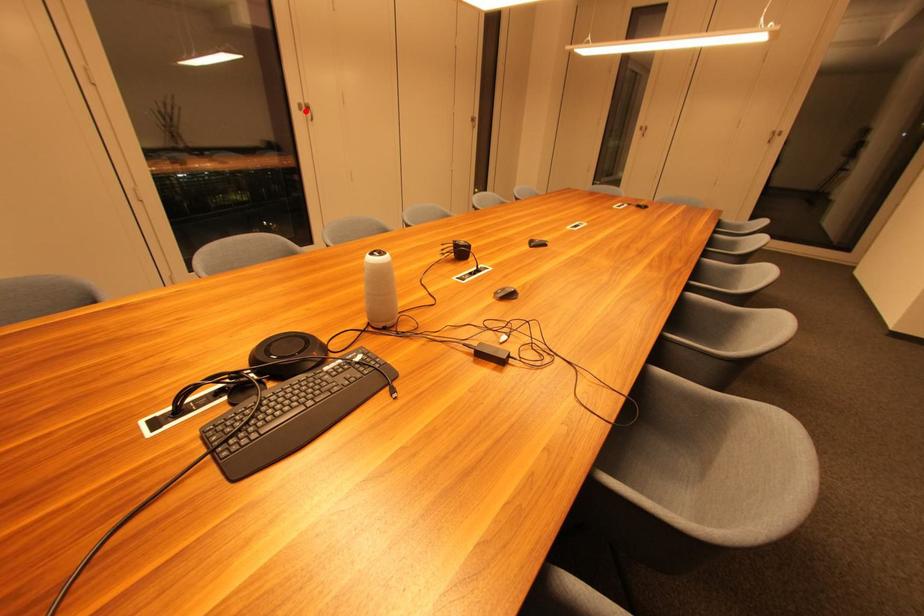
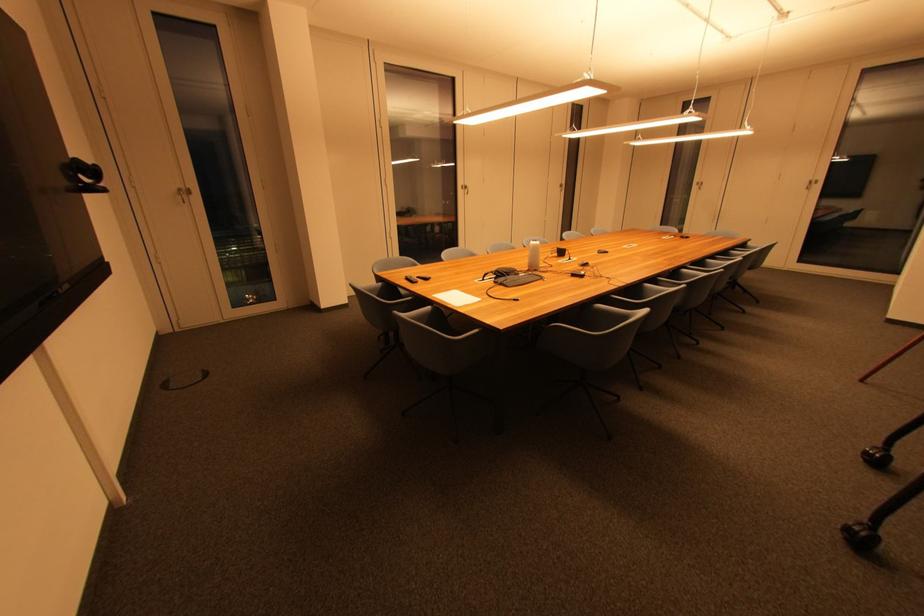
Question: I am providing you with two images of the same scene from different viewpoints. In image1, a red point is highlighted. Considering the same 3D point in image2, which of the following is correct?

Choices:
 (A) It is closer
 (B) It is farther

Answer: (A)